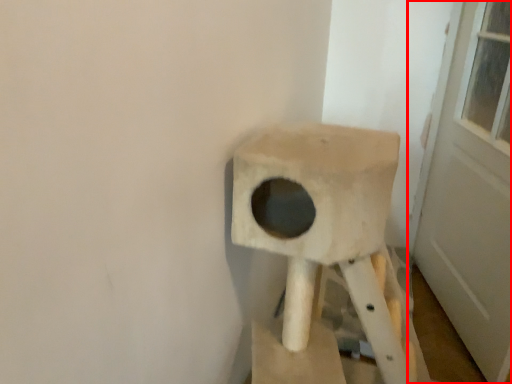
Question: From the image's perspective, what is the correct spatial positioning of door (annotated by the red box) in reference to swivel chair?

Choices:
 (A) above
 (B) below

Answer: (A)